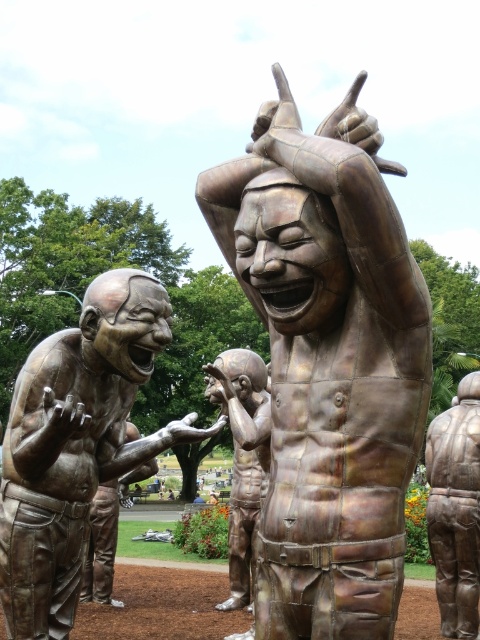
Is bronze statue at center wider than bronze statue at right?

Indeed, bronze statue at center has a greater width compared to bronze statue at right.

Does bronze statue at center have a lesser width compared to bronze statue at right?

No, bronze statue at center is not thinner than bronze statue at right.

What do you see at coordinates (328, 364) in the screenshot? This screenshot has width=480, height=640. I see `bronze statue at center` at bounding box center [328, 364].

Find the location of `bronze statue at center`. bronze statue at center is located at coordinates (328, 364).

Who is more distant from viewer, (x=335, y=349) or (x=192, y=435)?

Positioned behind is point (x=192, y=435).

Measure the distance between bronze statue at center and camera.

The distance of bronze statue at center from camera is 8.23 feet.

Where is `bronze statue at center`? bronze statue at center is located at coordinates (328, 364).

Which is below, bronze/statue at left or bronze statue at right?

bronze statue at right is below.

Looking at this image, does bronze/statue at left appear over bronze statue at right?

Yes, bronze/statue at left is above bronze statue at right.

Between point (98, 371) and point (462, 406), which one is positioned in front?

Positioned in front is point (98, 371).

Find the location of `bronze/statue at left`. bronze/statue at left is located at coordinates (75, 444).